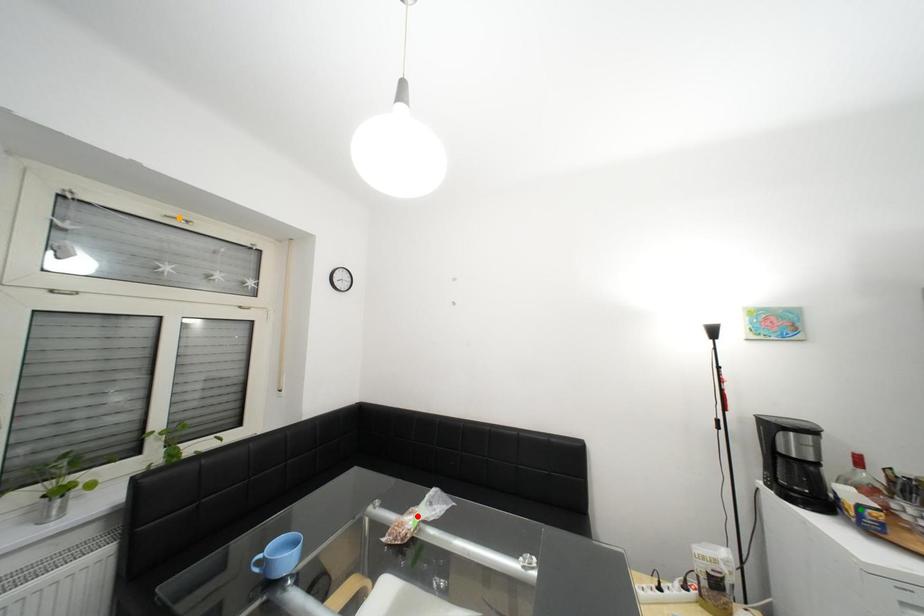
Order these from nearest to farthest:
red point, orange point, green point

green point
red point
orange point